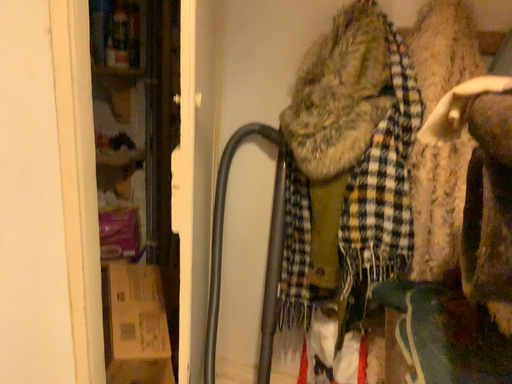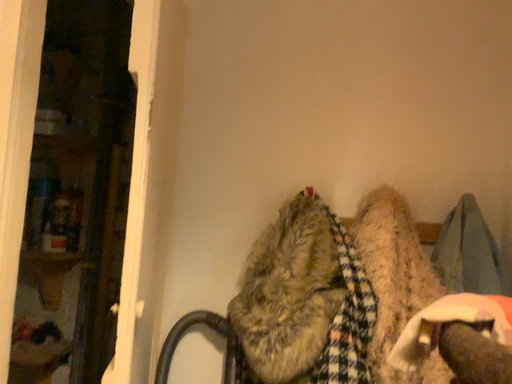
Question: Which way did the camera rotate in the video?

Choices:
 (A) rotated left
 (B) rotated right

Answer: (B)